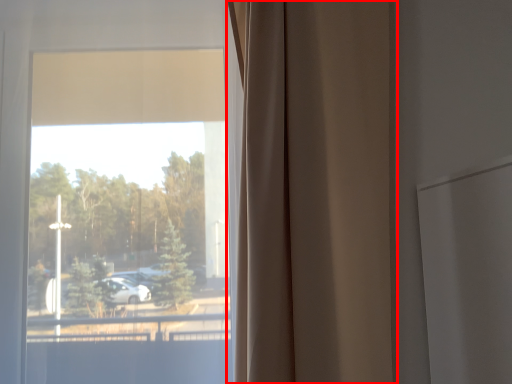
Question: Observing the image, what is the correct spatial positioning of curtain (annotated by the red box) in reference to window?

Choices:
 (A) right
 (B) left

Answer: (A)